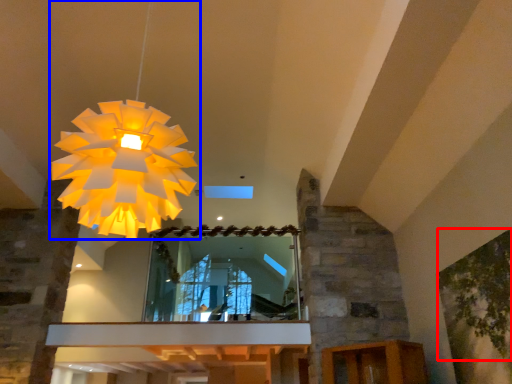
Question: Which point is closer to the camera, tree (highlighted by a red box) or lamp (highlighted by a blue box)?

Choices:
 (A) tree
 (B) lamp

Answer: (B)